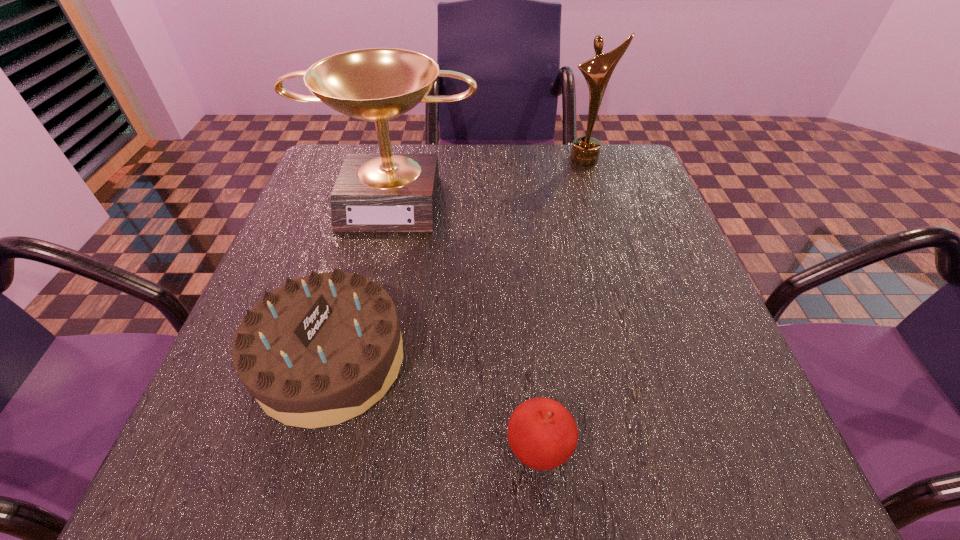
Where is `free space between the second shortest object and the right award`? free space between the second shortest object and the right award is located at coordinates (458, 259).

Find the location of a particular element. Image resolution: width=960 pixels, height=540 pixels. free space between the right award and the third tallest object is located at coordinates (458, 259).

At what (x,y) coordinates should I click in order to perform the action: click on object that is the third closest one to the left award. Please return your answer as a coordinate pair (x, y). This screenshot has height=540, width=960. Looking at the image, I should click on (542, 434).

Select which object appears as the closest to the birthday cake. Please provide its 2D coordinates. Your answer should be formatted as a tuple, i.e. [(x, y)], where the tuple contains the x and y coordinates of a point satisfying the conditions above.

[(542, 434)]

You are a GUI agent. You are given a task and a screenshot of the screen. Output one action in this format:
    pyautogui.click(x=<x>, y=<y>)
    Task: Click on the vacant space that satisfies the following two spatial constraints: 1. on the front-facing side of the right award; 2. on the front-facing side of the birthday cake
    
    Given the screenshot: What is the action you would take?
    pyautogui.click(x=648, y=360)

I want to click on vacant space that satisfies the following two spatial constraints: 1. on the front-facing side of the left award; 2. on the front-facing side of the third tallest object, so click(x=355, y=360).

You are a GUI agent. You are given a task and a screenshot of the screen. Output one action in this format:
    pyautogui.click(x=<x>, y=<y>)
    Task: Click on the blank space that satisfies the following two spatial constraints: 1. on the front-facing side of the left award; 2. on the right side of the third object from left to right
    
    Given the screenshot: What is the action you would take?
    pyautogui.click(x=335, y=449)

I want to click on free spot that satisfies the following two spatial constraints: 1. on the front-facing side of the birthday cake; 2. on the back side of the third object from left to right, so click(x=305, y=449).

Find the location of a particular element. Image resolution: width=960 pixels, height=540 pixels. vacant area in the image that satisfies the following two spatial constraints: 1. on the front-facing side of the left award; 2. on the front-facing side of the birthday cake is located at coordinates (355, 360).

Locate an element on the screen. This screenshot has height=540, width=960. vacant space that satisfies the following two spatial constraints: 1. on the front-facing side of the right award; 2. on the front-facing side of the birthday cake is located at coordinates (648, 360).